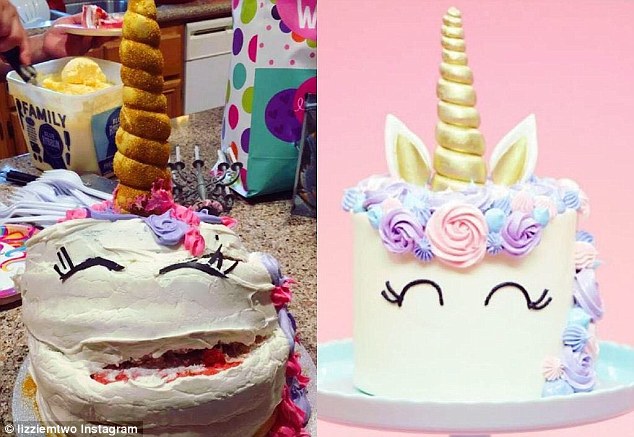
Where is `fork`? fork is located at coordinates (74, 178), (85, 198), (49, 192), (21, 196), (26, 219), (27, 212), (30, 206).